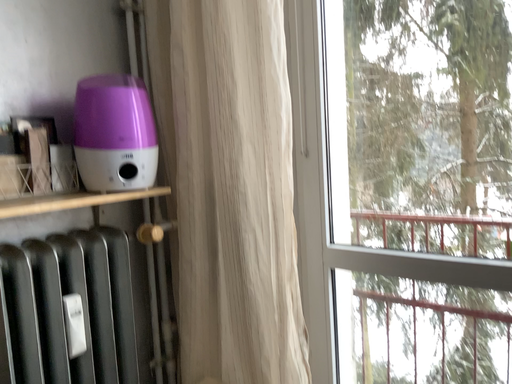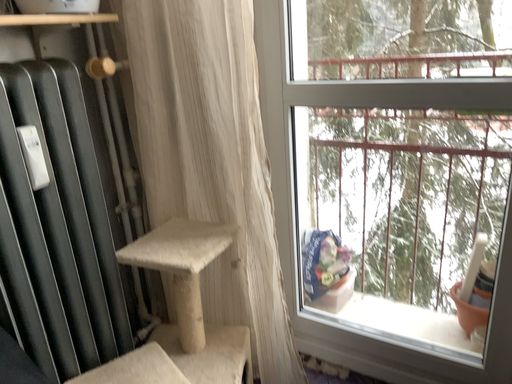
Question: How did the camera likely rotate when shooting the video?

Choices:
 (A) rotated downward
 (B) rotated upward

Answer: (A)